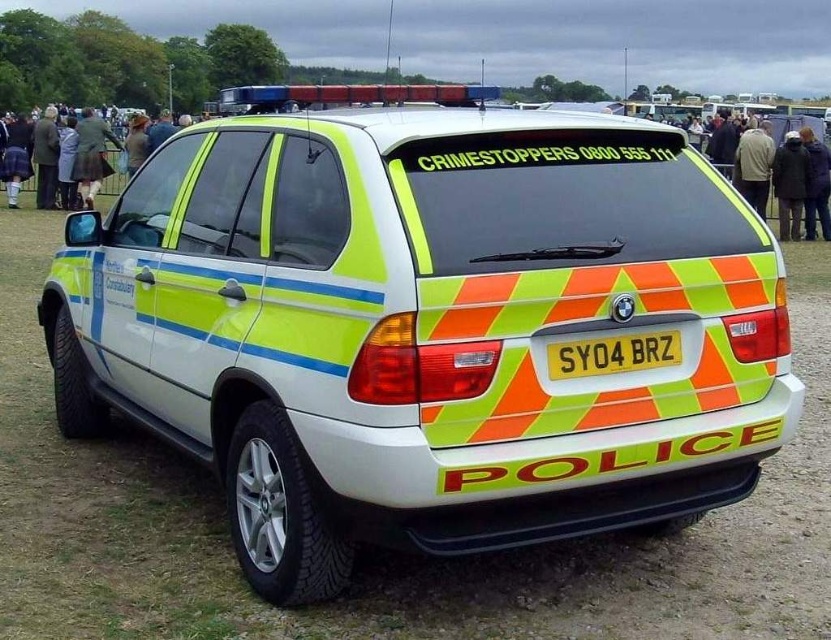
You are a pedestrian standing in front of the police vehicle. You want to read the text on the yellow plastic license plate at rear. Can you see it clearly from your current position?

The yellow plastic license plate at rear is 2.02 meters from viewer, so yes, you can see it clearly from your current position.

You are a pedestrian standing at the point with coordinates (x=426, y=328). What object are you directly in front of?

Result: You are directly in front of the reflective fluorescent police car at center.